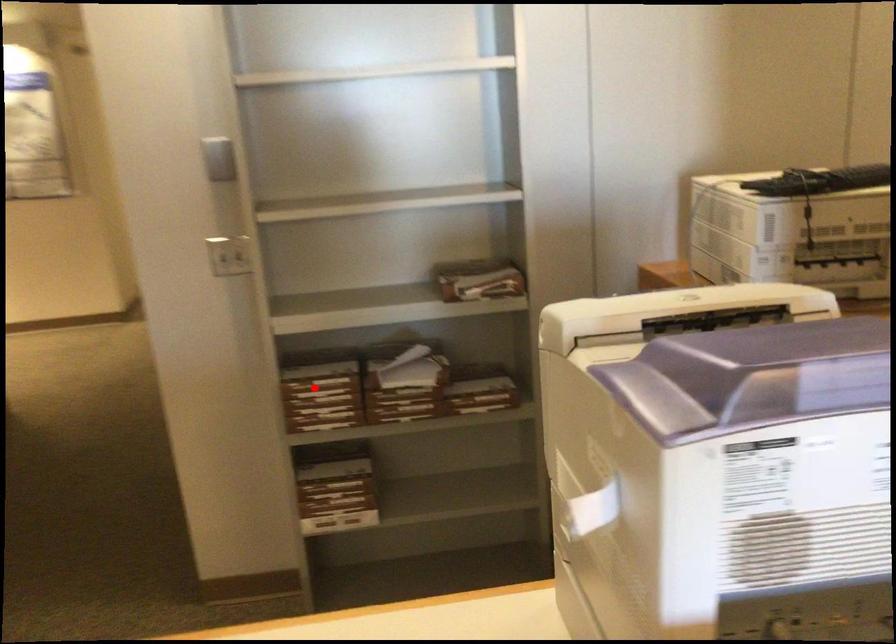
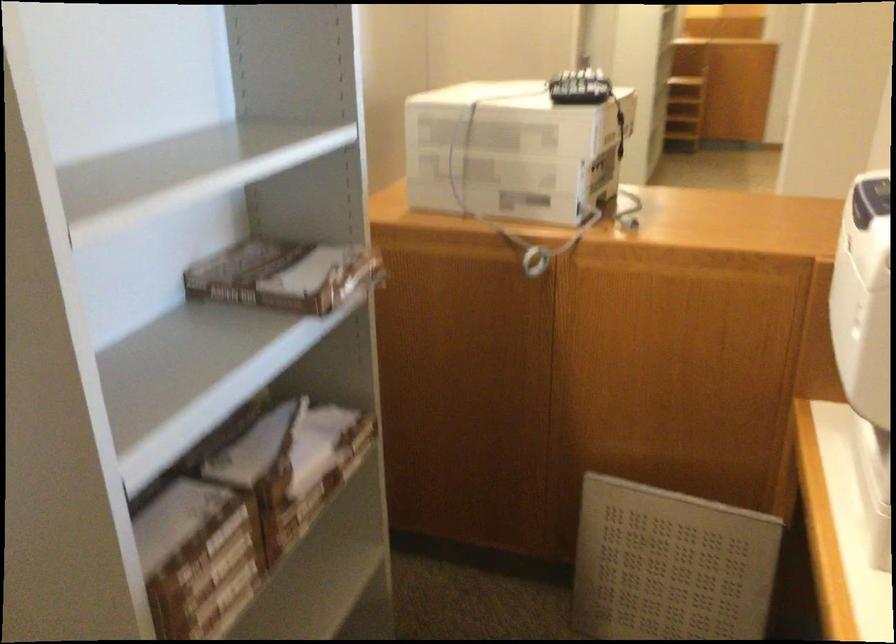
Question: I am providing you with two images of the same scene from different viewpoints. Image1 has a red point marked. In image2, the corresponding 3D location appears at what relative position? Reply with the corresponding letter.

Choices:
 (A) Closer
 (B) Farther

Answer: (A)